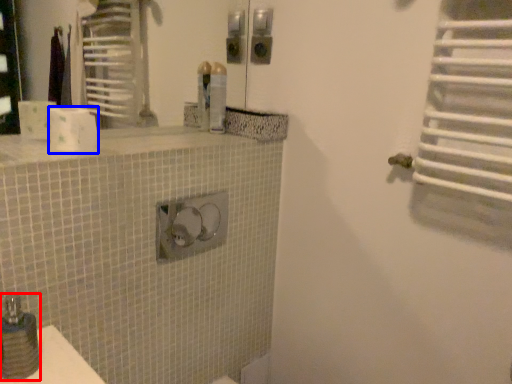
Question: Which object appears closest to the camera in this image, soap dispenser (highlighted by a red box) or toilet paper (highlighted by a blue box)?

Choices:
 (A) soap dispenser
 (B) toilet paper

Answer: (A)